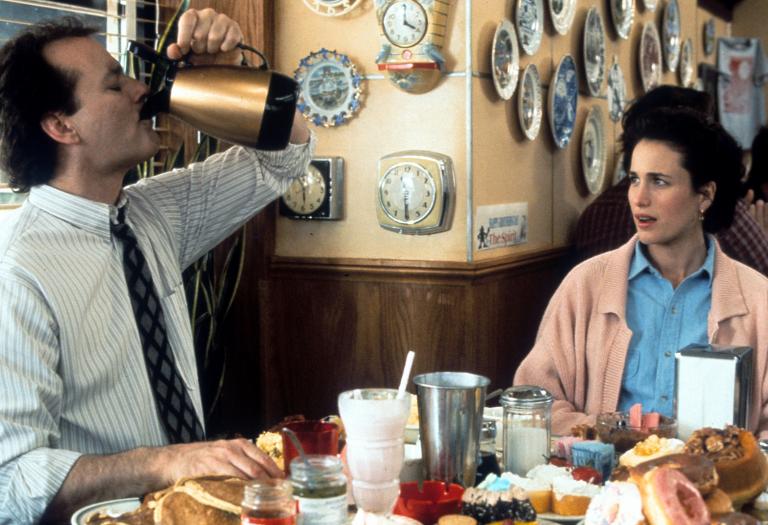
Locate an element on the screen. This screenshot has width=768, height=525. coffee pot is located at coordinates (253, 91).